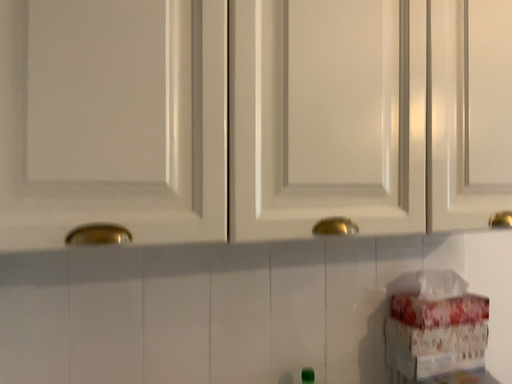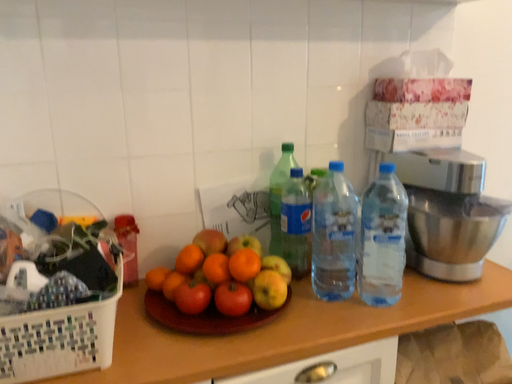
Question: How did the camera likely rotate when shooting the video?

Choices:
 (A) rotated downward
 (B) rotated upward

Answer: (A)